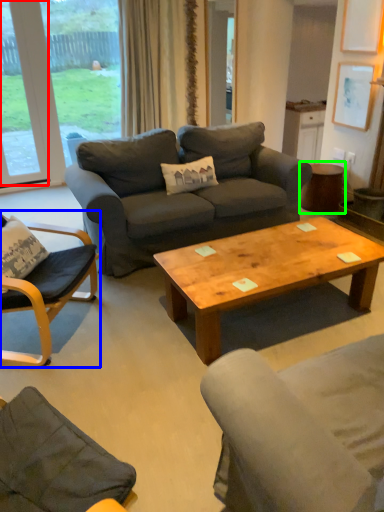
Question: Which is farther away from window (highlighted by a red box)? chair (highlighted by a blue box) or side table (highlighted by a green box)?

Choices:
 (A) chair
 (B) side table

Answer: (B)